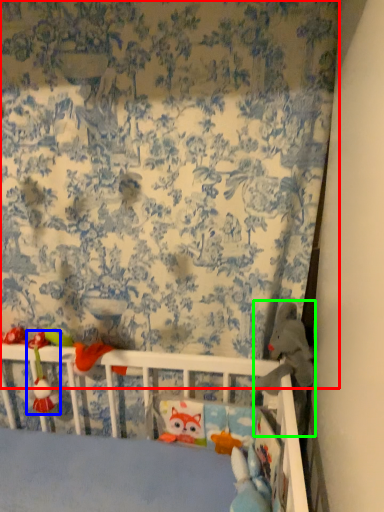
Question: Which object is positioned farthest from curtain (highlighted by a red box)? Select from toy (highlighted by a blue box) and toy (highlighted by a green box).

Choices:
 (A) toy
 (B) toy

Answer: (A)